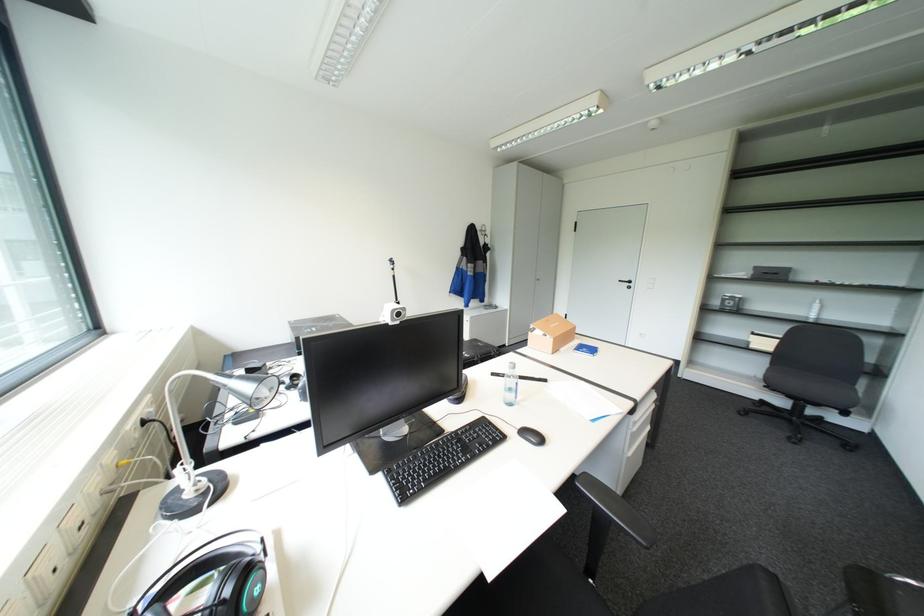
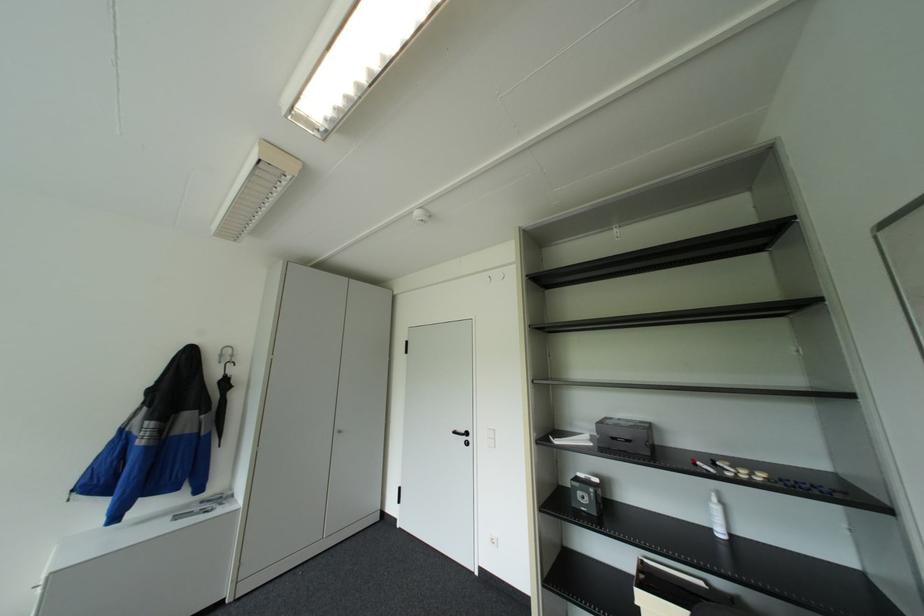
Find the pixel in the second image that matches point (820, 315) in the first image.

(725, 533)